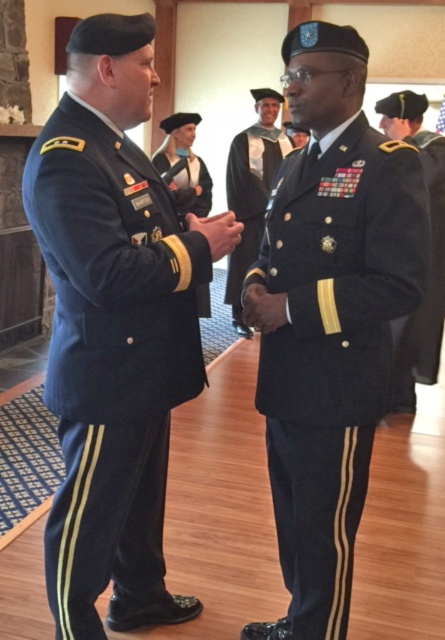
You are observing a military ceremony where two officers are interacting. You see a shiny black uniform at right and a matte black uniform at center. Which officer is positioned to the right of the other?

The shiny black uniform at right is to the right of the matte black uniform at center.